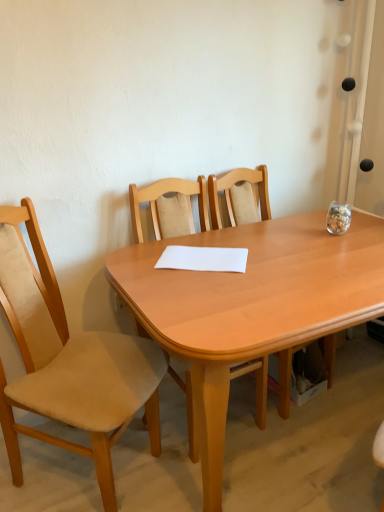
Question: Is white paper at center facing towards light wood chair at center, which is the second chair from right to left?

Choices:
 (A) yes
 (B) no

Answer: (A)

Question: Can you confirm if white paper at center is wider than light wood chair at center, placed as the 2th chair when sorted from left to right?

Choices:
 (A) yes
 (B) no

Answer: (B)

Question: Can you confirm if white paper at center is bigger than light wood chair at center, which is the second chair from right to left?

Choices:
 (A) yes
 (B) no

Answer: (B)

Question: From a real-world perspective, is white paper at center physically above light wood chair at center, which is the second chair from right to left?

Choices:
 (A) no
 (B) yes

Answer: (B)

Question: Is the depth of white paper at center greater than that of light wood chair at center, placed as the 2th chair when sorted from left to right?

Choices:
 (A) no
 (B) yes

Answer: (B)

Question: From the image's perspective, is white paper at center positioned above or below beige fabric chair at left, placed as the third chair when sorted from right to left?

Choices:
 (A) above
 (B) below

Answer: (A)

Question: Considering the relative positions of white paper at center and beige fabric chair at left, placed as the third chair when sorted from right to left, in the image provided, is white paper at center to the left or to the right of beige fabric chair at left, placed as the third chair when sorted from right to left,?

Choices:
 (A) left
 (B) right

Answer: (B)

Question: Is white paper at center taller or shorter than beige fabric chair at left, the first chair when ordered from left to right?

Choices:
 (A) short
 (B) tall

Answer: (A)

Question: In terms of width, does white paper at center look wider or thinner when compared to beige fabric chair at left, placed as the third chair when sorted from right to left?

Choices:
 (A) thin
 (B) wide

Answer: (A)

Question: Is point (233, 252) closer or farther from the camera than point (306, 314)?

Choices:
 (A) farther
 (B) closer

Answer: (A)

Question: Choose the correct answer: Is white paper at center inside light wood table at center or outside it?

Choices:
 (A) outside
 (B) inside

Answer: (B)

Question: Is white paper at center in front of or behind light wood table at center in the image?

Choices:
 (A) front
 (B) behind

Answer: (B)

Question: From the image's perspective, is white paper at center above or below light wood table at center?

Choices:
 (A) below
 (B) above

Answer: (B)

Question: Is wooden chair at center, the first chair in the right-to-left sequence, bigger or smaller than light wood chair at center, placed as the 2th chair when sorted from left to right?

Choices:
 (A) big
 (B) small

Answer: (B)

Question: Considering the positions of wooden chair at center, which is the 3th chair from left to right, and light wood chair at center, placed as the 2th chair when sorted from left to right, in the image, is wooden chair at center, which is the 3th chair from left to right, wider or thinner than light wood chair at center, placed as the 2th chair when sorted from left to right,?

Choices:
 (A) wide
 (B) thin

Answer: (B)